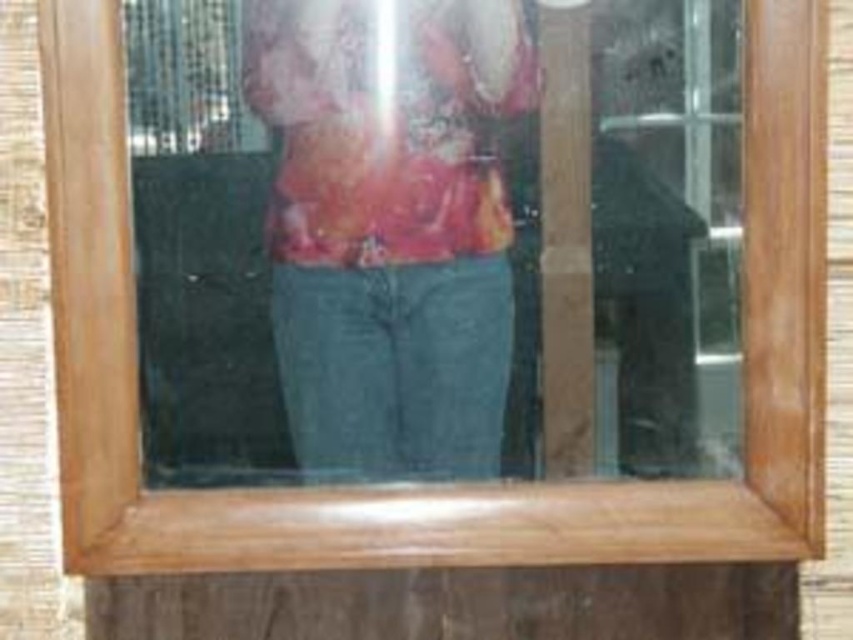
You are an interior designer trying to place a new painting that is 0.3 meters wide. The matte glass mirror at center is currently occupying space at point 0.380, 0.508. Will the painting fit without overlapping the mirror if placed at the same point?

The matte glass mirror at center is located at point (432,243). Since the painting is 0.3 meters wide, it would overlap the mirror if placed at the same point, so it cannot be placed there without overlapping.

You are trying to hang a matte floral shirt at center on a wall hook that can only hold items up to the width of the matte glass mirror at center. Will the shirt fit on the hook?

The matte glass mirror at center is wider than the matte floral shirt at center, so the shirt will fit on the hook since its width is smaller than the mirror.

You are standing in front of the wooden framed mirror and want to place a small sticker exactly at the center of the mirror. The mirror has a coordinate system where the bottom left corner is the origin. Can you determine if the point you marked at coordinates point (432,243) is at the center of the matte glass mirror at center?

The point (432,243) is on the matte glass mirror at center, so yes, the sticker placed at point (432,243) would be at the center of the matte glass mirror at center.